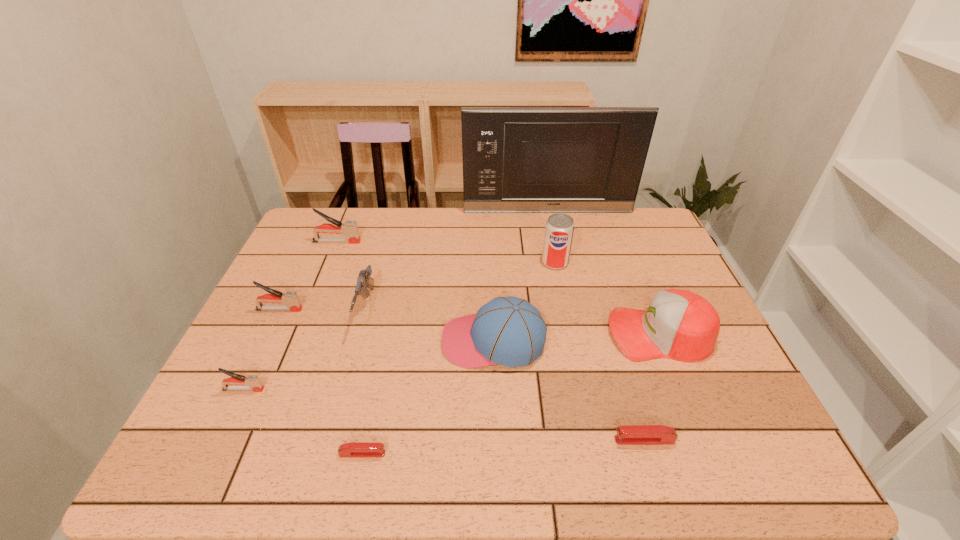
Locate an element on the screen. empty space that is in between the red baseball cap and the sixth object from right to left is located at coordinates (511, 394).

Identify the location of vacant region between the farthest gray stapler and the third farthest object. (445, 252).

Locate which object is the eighth closest to the nearest gray stapler. Please provide its 2D coordinates. Your answer should be formatted as a tuple, i.e. [(x, y)], where the tuple contains the x and y coordinates of a point satisfying the conditions above.

[(681, 325)]

Identify which object is the seventh closest to the farthest gray stapler. Please provide its 2D coordinates. Your answer should be formatted as a tuple, i.e. [(x, y)], where the tuple contains the x and y coordinates of a point satisfying the conditions above.

[(352, 449)]

Where is `stapler that is the fifth closest to the left baseball cap`? This screenshot has height=540, width=960. stapler that is the fifth closest to the left baseball cap is located at coordinates (349, 228).

Where is `stapler object that ranks as the fourth closest to the right baseball cap`? stapler object that ranks as the fourth closest to the right baseball cap is located at coordinates (290, 298).

The width and height of the screenshot is (960, 540). I want to click on the closest gray stapler to the farthest object, so click(x=349, y=228).

The width and height of the screenshot is (960, 540). In order to click on the closest gray stapler relative to the second smallest gray stapler in this screenshot , I will do `click(254, 384)`.

The height and width of the screenshot is (540, 960). In order to click on free space that satisfies the following two spatial constraints: 1. on the handle side of the second farthest object; 2. on the right side of the second tallest object in this screenshot , I will do [x=328, y=262].

Locate an element on the screen. The width and height of the screenshot is (960, 540). vacant area in the image that satisfies the following two spatial constraints: 1. on the handle side of the tallest stapler; 2. on the left side of the soda is located at coordinates (328, 262).